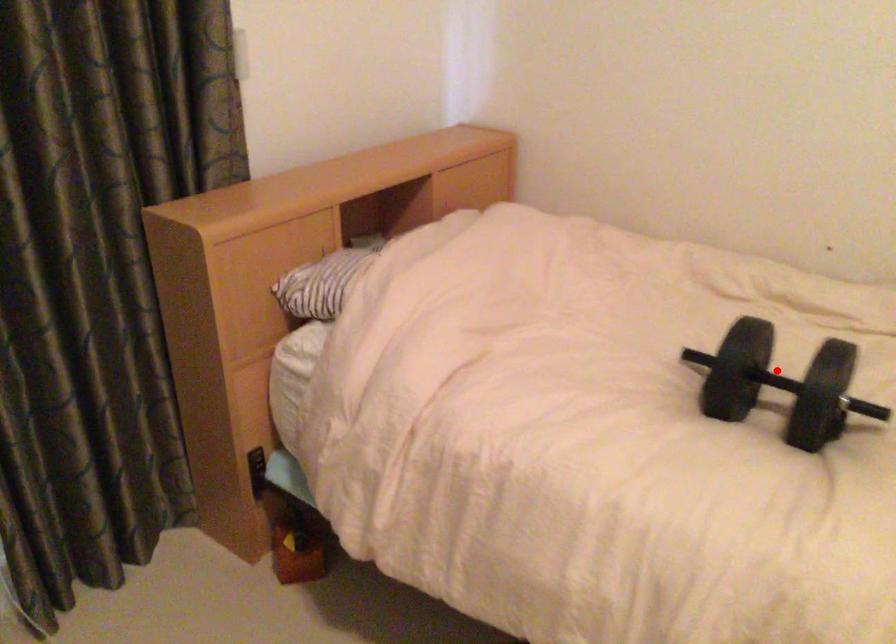
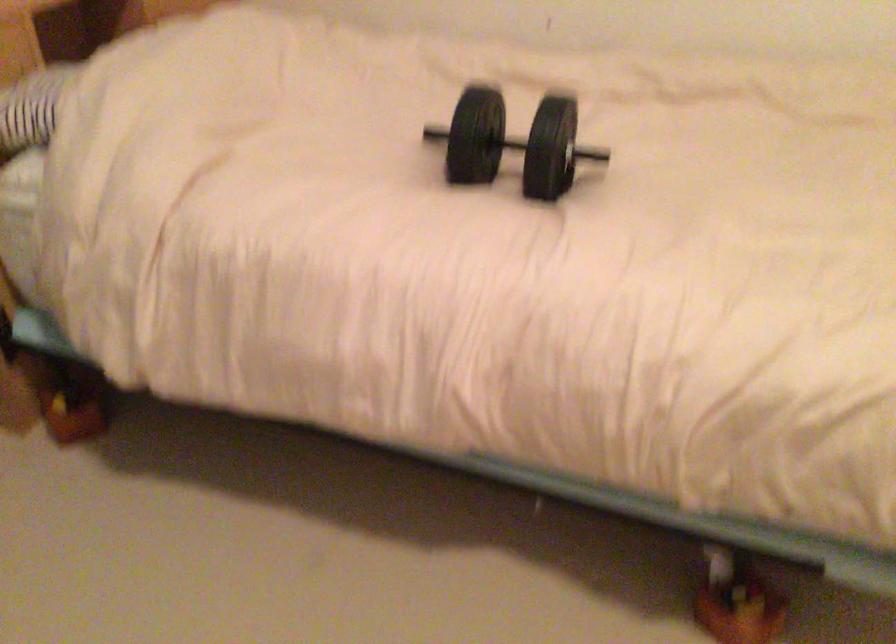
In the second image, find the point that corresponds to the highlighted location in the first image.

(513, 143)